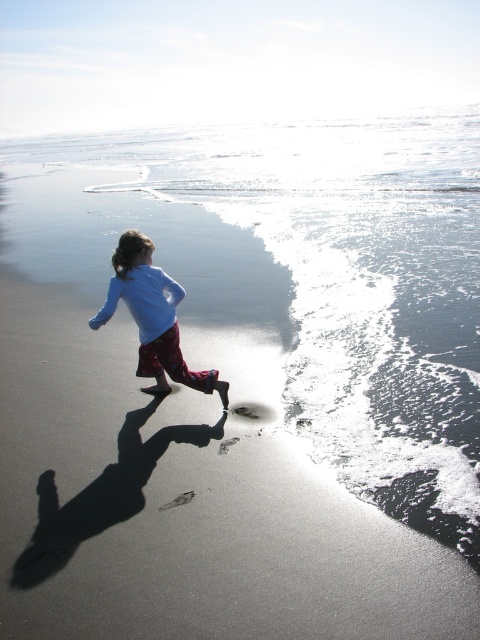
Can you confirm if sandy beach at lower left is shorter than light blue fabric shirt at center?

Incorrect, sandy beach at lower left's height does not fall short of light blue fabric shirt at center's.

Image resolution: width=480 pixels, height=640 pixels. What do you see at coordinates (177, 451) in the screenshot? I see `sandy beach at lower left` at bounding box center [177, 451].

Identify the location of sandy beach at lower left. (177, 451).

Which is below, light blue fabric shirt at center or brown sandy footprint at lower center?

brown sandy footprint at lower center is below.

Can you confirm if light blue fabric shirt at center is positioned to the right of brown sandy footprint at lower center?

Incorrect, light blue fabric shirt at center is not on the right side of brown sandy footprint at lower center.

Does point (178, 332) come in front of point (158, 509)?

No, it is behind (158, 509).

Locate an element on the screen. light blue fabric shirt at center is located at coordinates pos(153,317).

Locate an element on the screen. sandy beach at lower left is located at coordinates (177, 451).

Which is below, sandy beach at lower left or brown sandy footprint at lower center?

brown sandy footprint at lower center is below.

Between point (56, 243) and point (180, 497), which one is positioned in front?

Point (180, 497) is in front.

You are a GUI agent. You are given a task and a screenshot of the screen. Output one action in this format:
    pyautogui.click(x=<x>, y=<y>)
    Task: Click on the sandy beach at lower left
    The width and height of the screenshot is (480, 640).
    Given the screenshot: What is the action you would take?
    pyautogui.click(x=177, y=451)